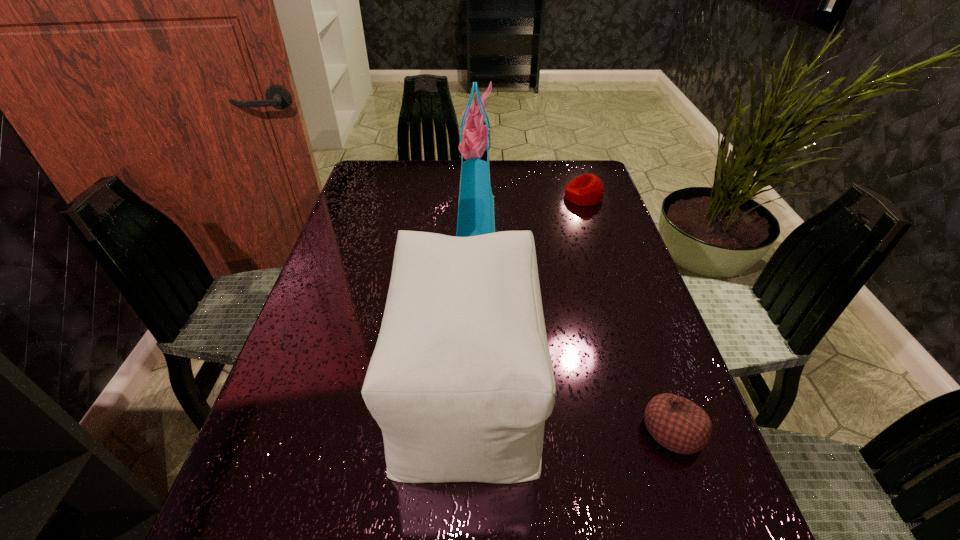
You are a GUI agent. You are given a task and a screenshot of the screen. Output one action in this format:
    pyautogui.click(x=<x>, y=<y>)
    Task: Click on the vacant space that satisfies the following two spatial constraints: 1. on the seat area of the farther beanbag; 2. on the front side of the shopping bag
    This screenshot has width=960, height=540.
    Given the screenshot: What is the action you would take?
    pyautogui.click(x=590, y=218)